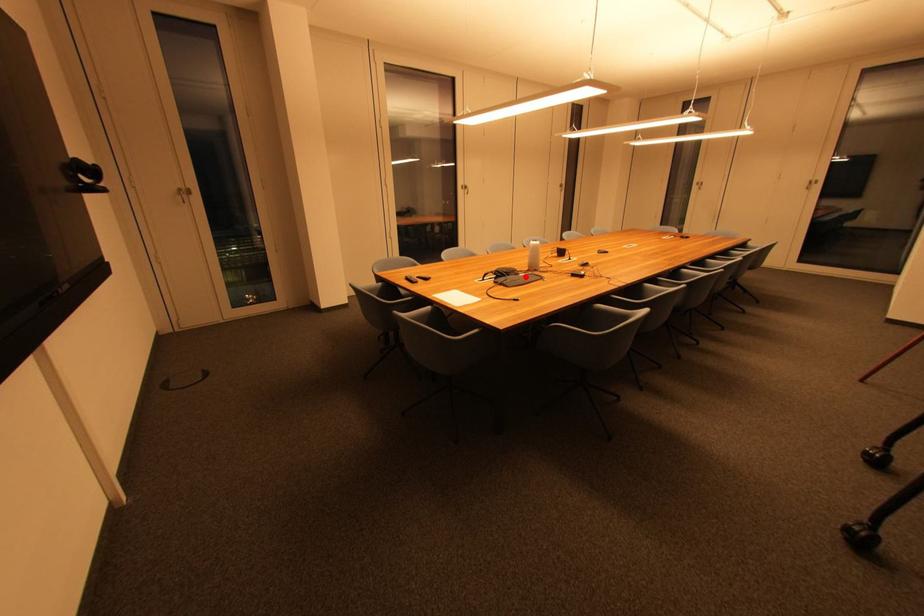
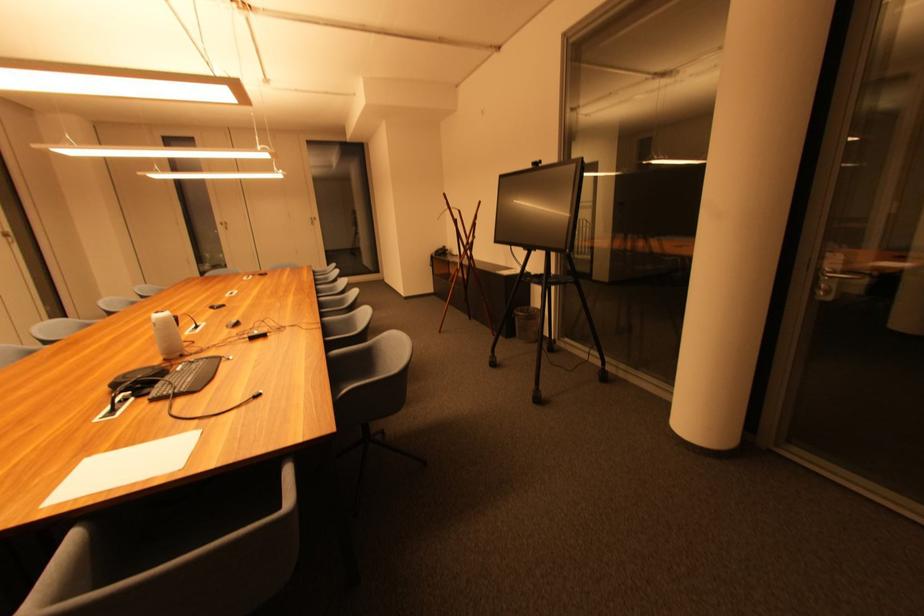
Locate, in the second image, the point that corresponds to the highlighted location in the first image.

(184, 371)